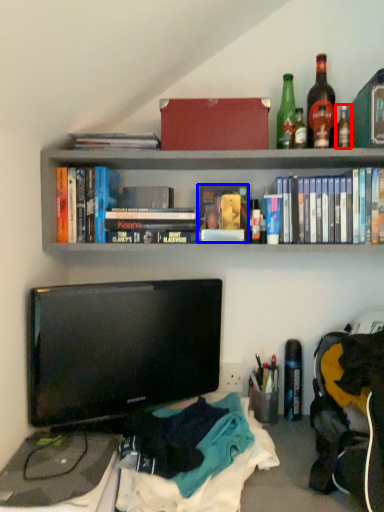
Question: Which of the following is the closest to the observer, bottle (highlighted by a red box) or paperback book (highlighted by a blue box)?

Choices:
 (A) bottle
 (B) paperback book

Answer: (A)